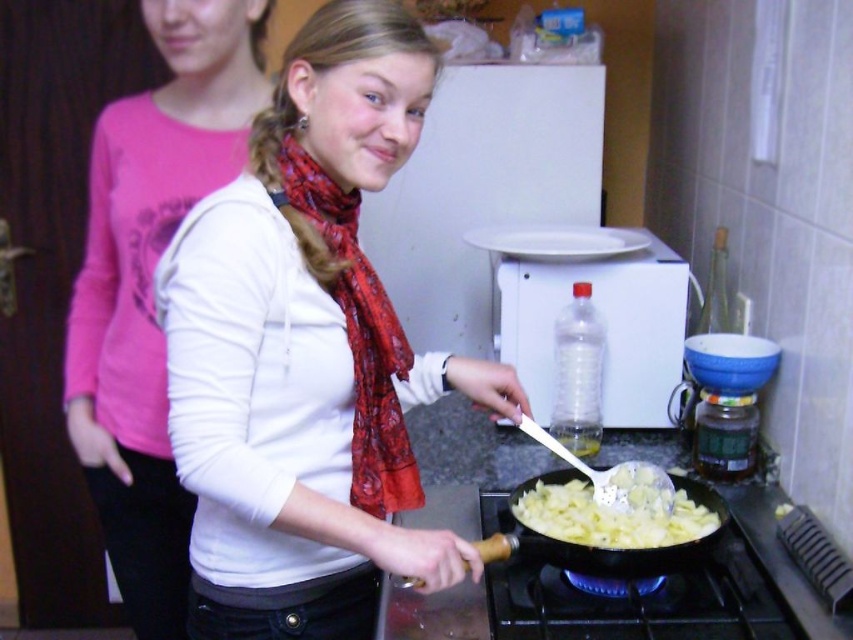
You are a chef standing in the kitchen and need to adjust the height of the blue flame gas stove at lower center to reach the white matte scarf at center. Based on their current heights, is the stove tall enough for you to comfortably reach the scarf without needing a stool?

The white matte scarf at center is taller than the blue flame gas stove at lower center, meaning the stove is shorter than the scarf. Therefore, the stove is not tall enough for you to comfortably reach the scarf without a stool.

You are a chef in a busy kitchen and need to quickly identify the size of the objects in the scene. Which object is larger between the pink fabric shirt at left and the wooden handle pan at center?

The pink fabric shirt at left is bigger than the wooden handle pan at center according to the description.

You are a delivery person who just arrived at the kitchen. You need to place a large package on the counter. The package is as big as the pink fabric shirt at left. Is there enough space next to the blue flame gas stove at lower center?

The pink fabric shirt at left is bigger than the blue flame gas stove at lower center. Since the package is as big as the pink fabric shirt at left, it may not fit next to the blue flame gas stove at lower center due to the size difference.